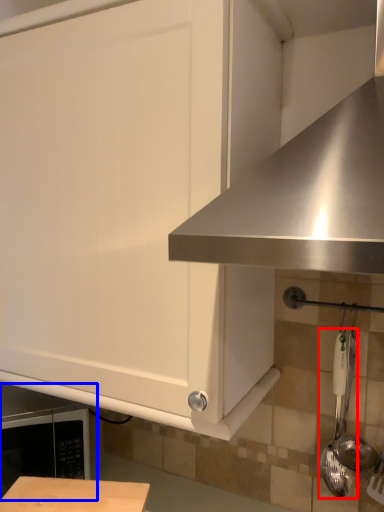
Question: Which of the following is the farthest to the observer, utensil (highlighted by a red box) or appliance (highlighted by a blue box)?

Choices:
 (A) utensil
 (B) appliance

Answer: (B)